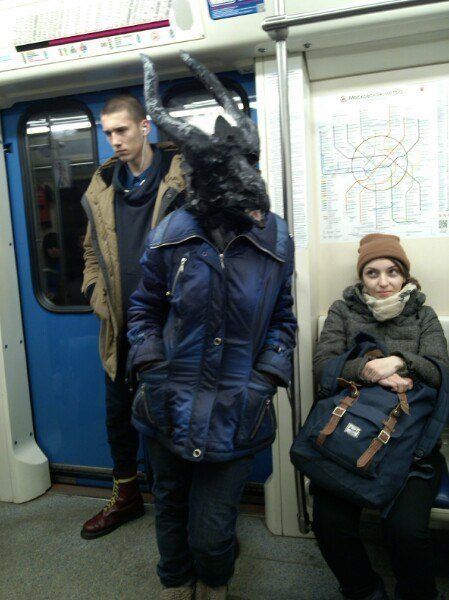
Find the location of `gray carpet`. gray carpet is located at coordinates (249, 576).